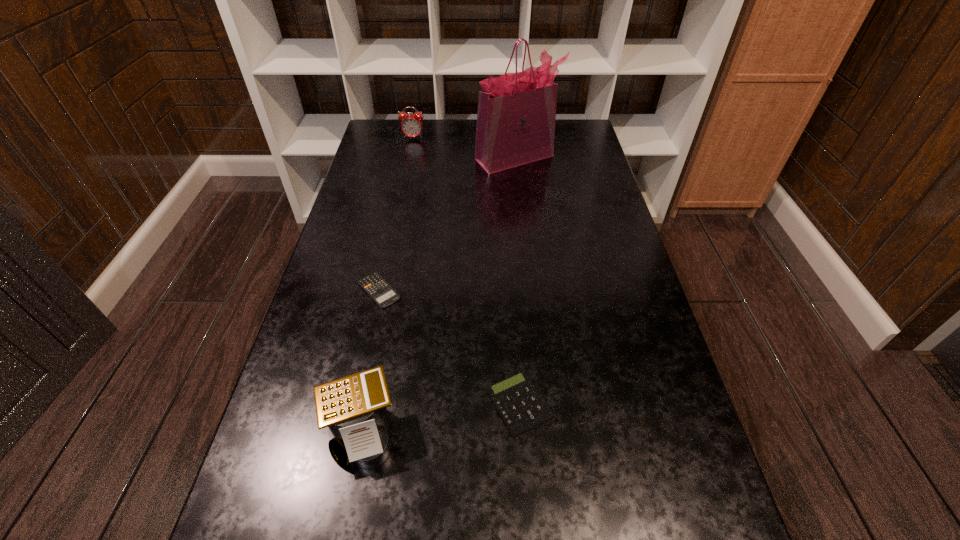
I want to click on vacant space located on the back of the tallest calculator, so click(378, 347).

Find the location of `vacant space situated 0.060m on the right of the second shortest object`. vacant space situated 0.060m on the right of the second shortest object is located at coordinates (582, 404).

Identify the location of vacant region located 0.290m on the back of the shortest calculator. (397, 205).

Where is `shopping bag at the far edge`? Image resolution: width=960 pixels, height=540 pixels. shopping bag at the far edge is located at coordinates (516, 117).

The image size is (960, 540). In order to click on alarm clock that is at the far edge in this screenshot , I will do `click(411, 126)`.

The width and height of the screenshot is (960, 540). In order to click on alarm clock at the left edge in this screenshot , I will do `click(411, 126)`.

You are a GUI agent. You are given a task and a screenshot of the screen. Output one action in this format:
    pyautogui.click(x=<x>, y=<y>)
    Task: Click on the object that is at the right edge
    Image resolution: width=960 pixels, height=540 pixels.
    Given the screenshot: What is the action you would take?
    pyautogui.click(x=516, y=117)

At what (x,y) coordinates should I click in order to perform the action: click on object that is at the far left corner. Please return your answer as a coordinate pair (x, y). This screenshot has height=540, width=960. Looking at the image, I should click on (411, 126).

Identify the location of object that is at the far right corner. pyautogui.click(x=516, y=117).

Where is `free space at the far edge of the desktop`? This screenshot has width=960, height=540. free space at the far edge of the desktop is located at coordinates (427, 147).